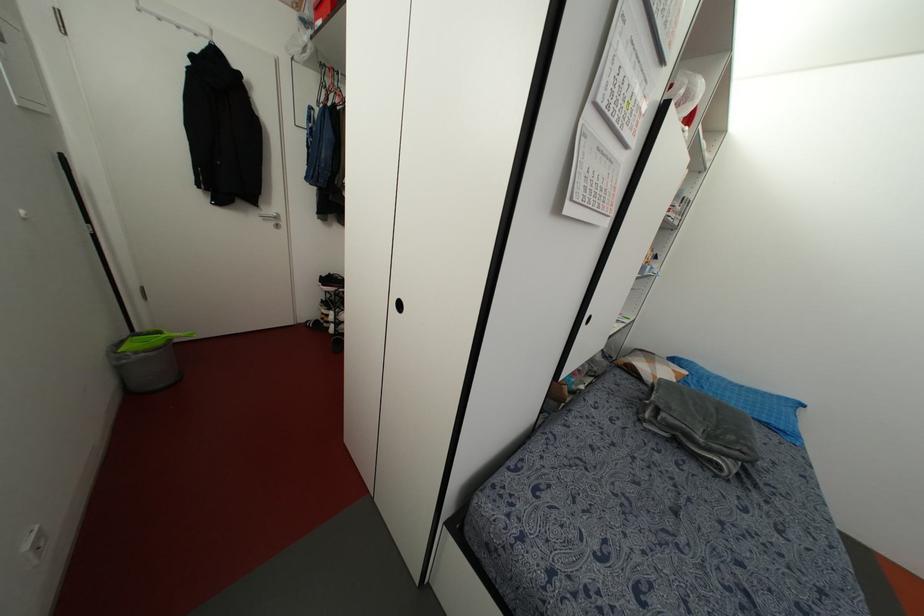
Where would you lift the folded grey blanket? Please return your answer as a coordinate pair (x, y).

(700, 426)